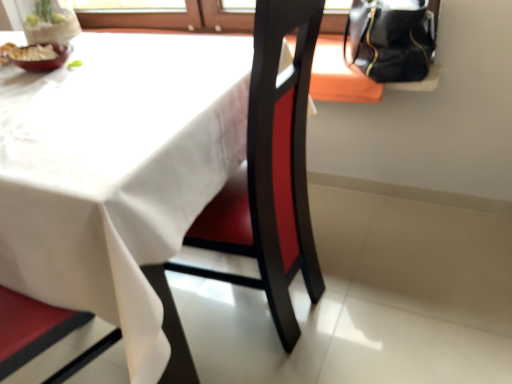
Question: Is the position of matte ceramic bowl at upper left less distant than that of black leather handbag at upper right?

Choices:
 (A) no
 (B) yes

Answer: (B)

Question: From the image's perspective, is matte ceramic bowl at upper left on black leather handbag at upper right?

Choices:
 (A) no
 (B) yes

Answer: (A)

Question: Considering the relative sizes of matte ceramic bowl at upper left and black leather handbag at upper right in the image provided, is matte ceramic bowl at upper left wider than black leather handbag at upper right?

Choices:
 (A) no
 (B) yes

Answer: (A)

Question: Is black leather handbag at upper right a part of matte ceramic bowl at upper left?

Choices:
 (A) yes
 (B) no

Answer: (B)

Question: Is matte ceramic bowl at upper left facing towards black leather handbag at upper right?

Choices:
 (A) yes
 (B) no

Answer: (B)

Question: Would you consider matte ceramic bowl at upper left to be distant from black leather handbag at upper right?

Choices:
 (A) no
 (B) yes

Answer: (A)

Question: From the image's perspective, would you say black leather handbag at upper right is shown under white matte table at center?

Choices:
 (A) no
 (B) yes

Answer: (A)

Question: Is black leather handbag at upper right located outside white matte table at center?

Choices:
 (A) no
 (B) yes

Answer: (B)

Question: Is black leather handbag at upper right smaller than white matte table at center?

Choices:
 (A) yes
 (B) no

Answer: (A)

Question: Is black leather handbag at upper right thinner than white matte table at center?

Choices:
 (A) yes
 (B) no

Answer: (A)

Question: Does black leather handbag at upper right have a larger size compared to white matte table at center?

Choices:
 (A) yes
 (B) no

Answer: (B)

Question: From a real-world perspective, is black leather handbag at upper right located beneath white matte table at center?

Choices:
 (A) yes
 (B) no

Answer: (B)

Question: Does white matte table at center have a larger size compared to matte ceramic bowl at upper left?

Choices:
 (A) yes
 (B) no

Answer: (A)